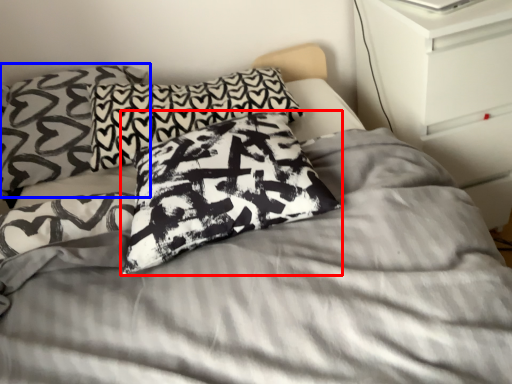
Question: Which object appears farthest to the camera in this image, pillow (highlighted by a red box) or pillow (highlighted by a blue box)?

Choices:
 (A) pillow
 (B) pillow

Answer: (B)